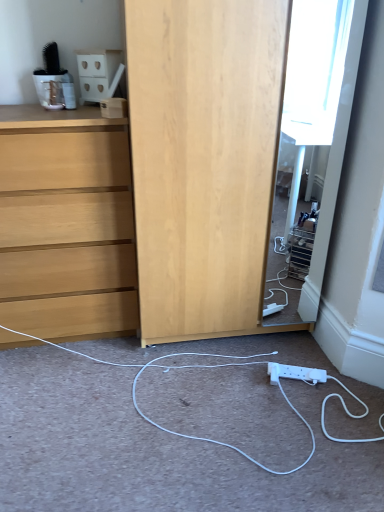
Question: Should I look upward or downward to see white plastic power strip at lower center?

Choices:
 (A) up
 (B) down

Answer: (B)

Question: Is white plastic power strip at lower center at the right side of white matte cabinet at upper left?

Choices:
 (A) no
 (B) yes

Answer: (B)

Question: From a real-world perspective, is white plastic power strip at lower center on top of white matte cabinet at upper left?

Choices:
 (A) no
 (B) yes

Answer: (A)

Question: Does white plastic power strip at lower center have a greater height compared to white matte cabinet at upper left?

Choices:
 (A) yes
 (B) no

Answer: (B)

Question: Is white plastic power strip at lower center shorter than white matte cabinet at upper left?

Choices:
 (A) yes
 (B) no

Answer: (A)

Question: Is white plastic power strip at lower center looking in the opposite direction of white matte cabinet at upper left?

Choices:
 (A) no
 (B) yes

Answer: (A)

Question: Is white plastic power strip at lower center to the left of white matte cabinet at upper left from the viewer's perspective?

Choices:
 (A) no
 (B) yes

Answer: (A)

Question: Is white matte cabinet at upper left facing towards white plastic power strip at lower center?

Choices:
 (A) yes
 (B) no

Answer: (B)

Question: Does white matte cabinet at upper left have a smaller size compared to white plastic power strip at lower center?

Choices:
 (A) no
 (B) yes

Answer: (A)

Question: Would you say white matte cabinet at upper left is outside white plastic power strip at lower center?

Choices:
 (A) no
 (B) yes

Answer: (B)

Question: Is white matte cabinet at upper left at the left side of white plastic power strip at lower center?

Choices:
 (A) no
 (B) yes

Answer: (B)

Question: Is there a large distance between white matte cabinet at upper left and white plastic power strip at lower center?

Choices:
 (A) no
 (B) yes

Answer: (B)

Question: Does white matte cabinet at upper left have a lesser width compared to white plastic power strip at lower center?

Choices:
 (A) no
 (B) yes

Answer: (A)

Question: From the image's perspective, is white matte cabinet at upper left over light wood chest of drawers at left?

Choices:
 (A) no
 (B) yes

Answer: (B)